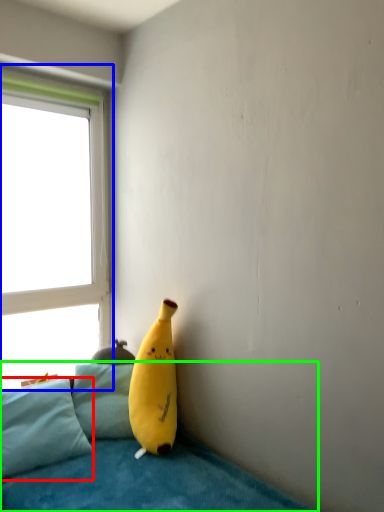
Question: Estimate the real-world distances between objects in this image. Which object is farther from pillow (highlighted by a red box), window (highlighted by a blue box) or studio couch (highlighted by a green box)?

Choices:
 (A) window
 (B) studio couch

Answer: (A)